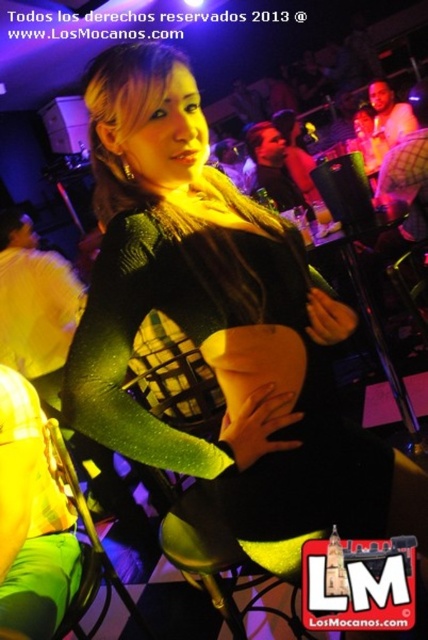
Does point (324, 316) lie behind point (392, 106)?

No.

Between green sparkly dress at center and matte black shirt at upper right, which one has more height?

With more height is green sparkly dress at center.

Locate an element on the screen. green sparkly dress at center is located at coordinates (222, 326).

Is green fabric shirt at lower left above matte black shirt at center?

No.

Can you confirm if green fabric shirt at lower left is wider than matte black shirt at center?

Incorrect, green fabric shirt at lower left's width does not surpass matte black shirt at center's.

You are a GUI agent. You are given a task and a screenshot of the screen. Output one action in this format:
    pyautogui.click(x=<x>, y=<y>)
    Task: Click on the green fabric shirt at lower left
    Image resolution: width=428 pixels, height=640 pixels.
    Given the screenshot: What is the action you would take?
    pyautogui.click(x=32, y=518)

Between matte black shirt at center and matte black shirt at upper right, which one appears on the left side from the viewer's perspective?

From the viewer's perspective, matte black shirt at center appears more on the left side.

Between matte black shirt at center and matte black shirt at upper right, which one has more height?

Standing taller between the two is matte black shirt at center.

Between point (259, 163) and point (413, 125), which one is positioned in front?

Positioned in front is point (259, 163).

Image resolution: width=428 pixels, height=640 pixels. I want to click on matte black shirt at center, so click(x=273, y=164).